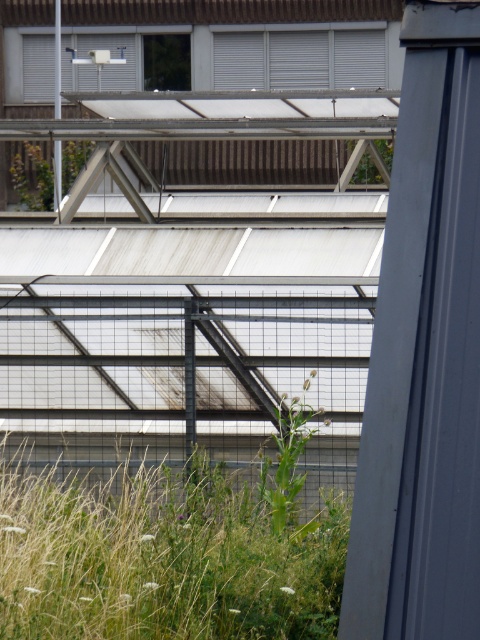
This screenshot has width=480, height=640. What do you see at coordinates (186, 371) in the screenshot?
I see `black metal fence at center` at bounding box center [186, 371].

Does black metal fence at center lie behind green leafy plant at lower center?

Yes.

Between point (202, 406) and point (278, 465), which one is positioned in front?

Point (278, 465)

You are a GUI agent. You are given a task and a screenshot of the screen. Output one action in this format:
    pyautogui.click(x=<x>, y=<y>)
    Task: Click on the black metal fence at center
    This screenshot has width=480, height=640.
    Given the screenshot: What is the action you would take?
    point(186,371)

Who is lower down, black metal fence at center or green leafy grass at lower left?

green leafy grass at lower left

Who is more distant from viewer, (106, 376) or (268, 550)?

Positioned behind is point (106, 376).

Who is more forward, (99,296) or (20,621)?

Point (20,621) is more forward.

Find the location of `black metal fence at center`. black metal fence at center is located at coordinates (186, 371).

How distant is green leafy grass at lower left from green leafy plant at lower center?

They are 83.68 centimeters apart.

You are a GUI agent. You are given a task and a screenshot of the screen. Output one action in this format:
    pyautogui.click(x=<x>, y=<y>)
    Task: Click on the green leafy grass at lower left
    The image size is (480, 640).
    Given the screenshot: What is the action you would take?
    pyautogui.click(x=162, y=557)